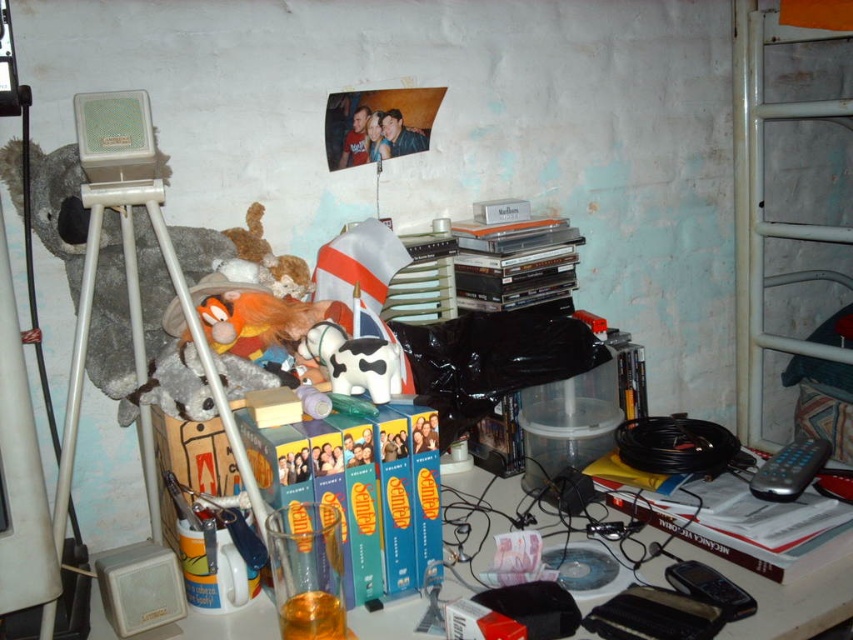
Is the position of transparent plastic table at center less distant than that of white matte cow at center?

Yes, transparent plastic table at center is closer to the viewer.

You are a GUI agent. You are given a task and a screenshot of the screen. Output one action in this format:
    pyautogui.click(x=<x>, y=<y>)
    Task: Click on the transparent plastic table at center
    
    Given the screenshot: What is the action you would take?
    pyautogui.click(x=785, y=596)

Is white matte cow at center in front of black plastic remote control at lower right?

Yes, white matte cow at center is in front of black plastic remote control at lower right.

Is white matte cow at center taller than black plastic remote control at lower right?

Indeed, white matte cow at center has a greater height compared to black plastic remote control at lower right.

Does point (337, 390) lie behind point (785, 448)?

That is False.

I want to click on white matte cow at center, so click(354, 362).

Can you confirm if transparent plastic table at center is thinner than black plastic remote control at lower right?

No, transparent plastic table at center is not thinner than black plastic remote control at lower right.

Which is more to the left, transparent plastic table at center or black plastic remote control at lower right?

transparent plastic table at center is more to the left.

Between point (836, 572) and point (763, 474), which one is positioned behind?

Point (763, 474)

The height and width of the screenshot is (640, 853). What are the coordinates of `transparent plastic table at center` in the screenshot? It's located at (785, 596).